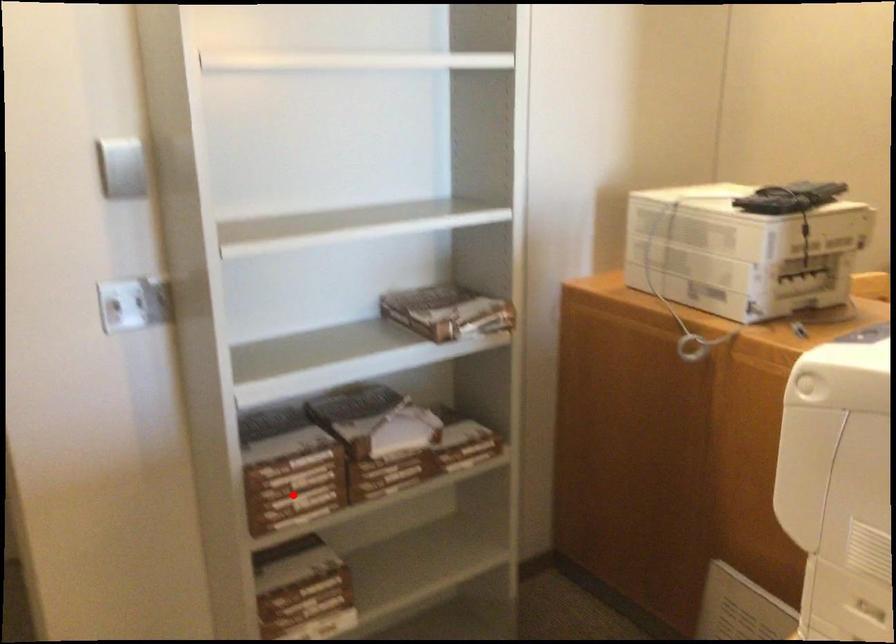
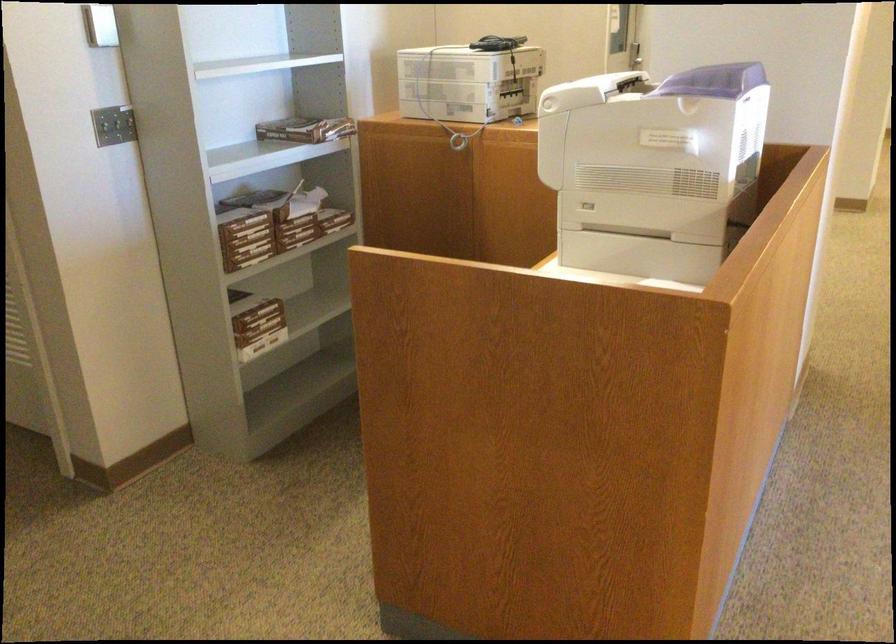
Find the pixel in the second image that matches the highlighted location in the first image.

(246, 237)